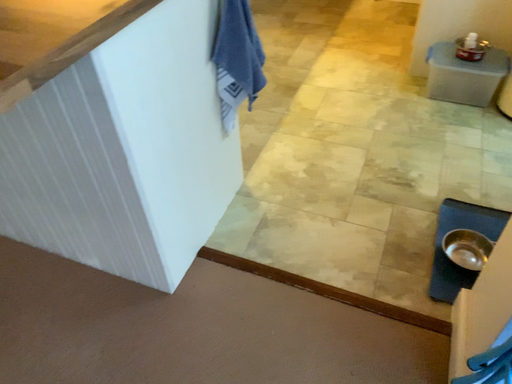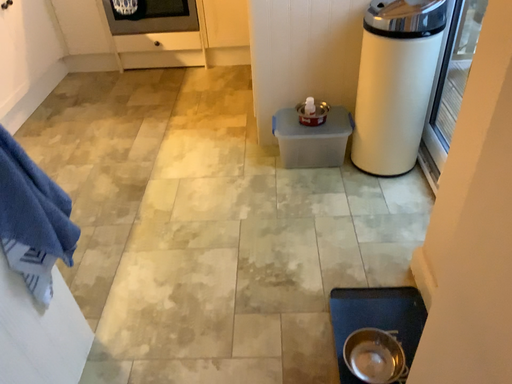
Question: Which way did the camera rotate in the video?

Choices:
 (A) rotated downward
 (B) rotated upward

Answer: (B)